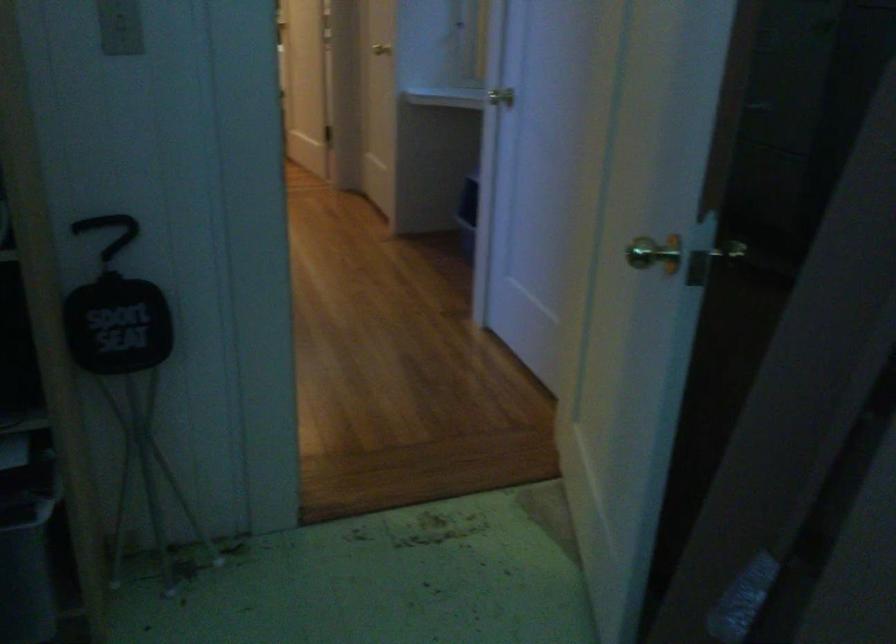
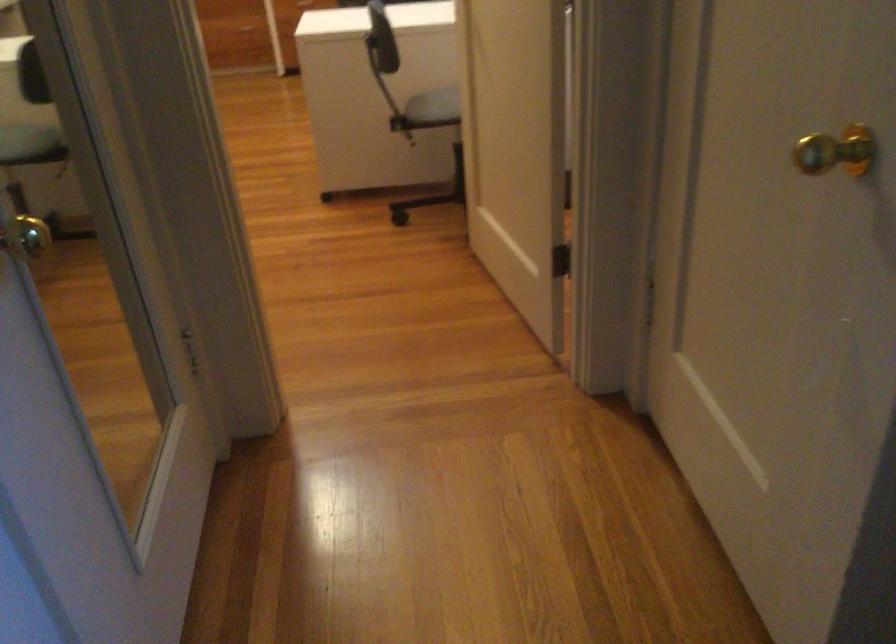
Question: The images are taken continuously from a first-person perspective. In which direction are you moving?

Choices:
 (A) Left
 (B) Right
 (C) Forward
 (D) Backward

Answer: (C)